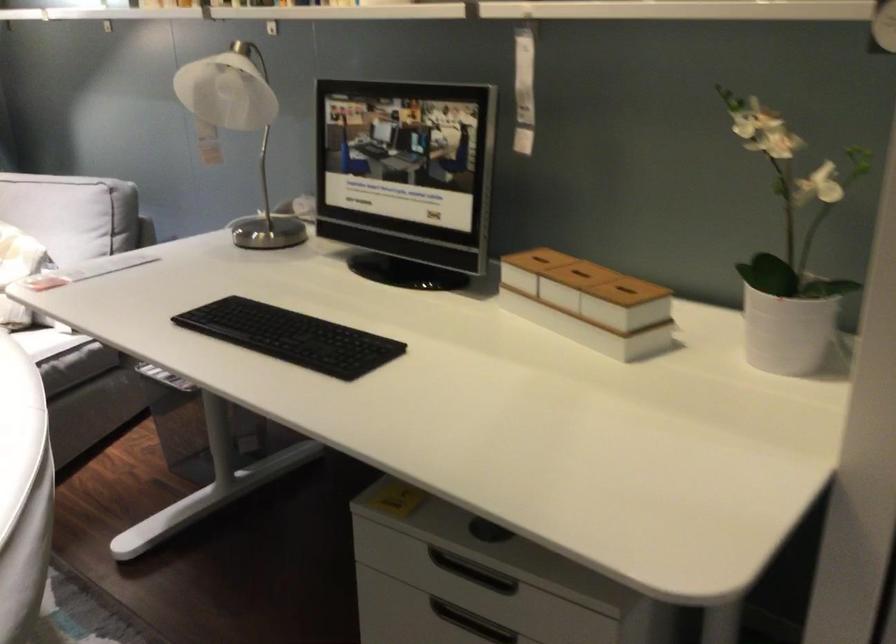
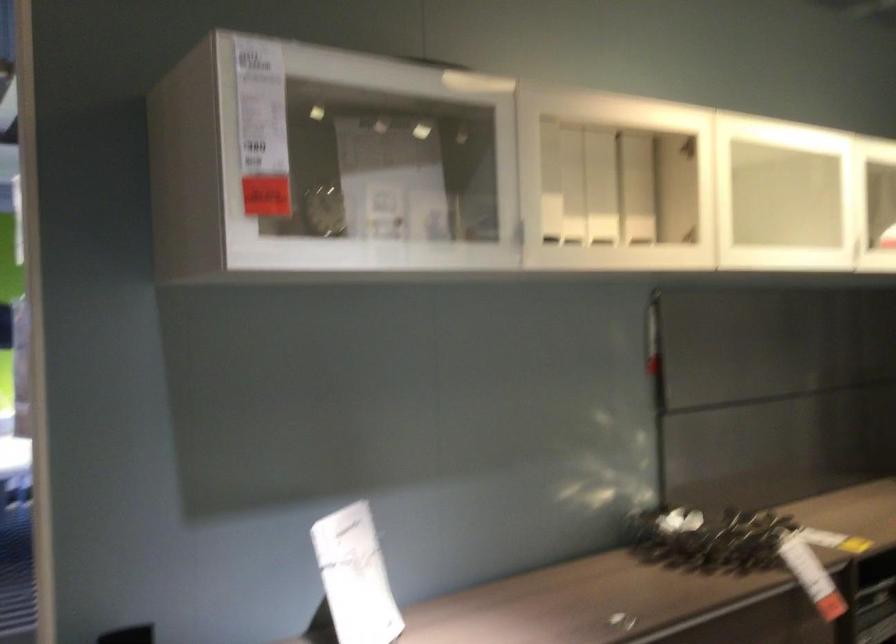
Question: How did the camera likely rotate?

Choices:
 (A) Left
 (B) Right
 (C) Up
 (D) Down

Answer: (A)